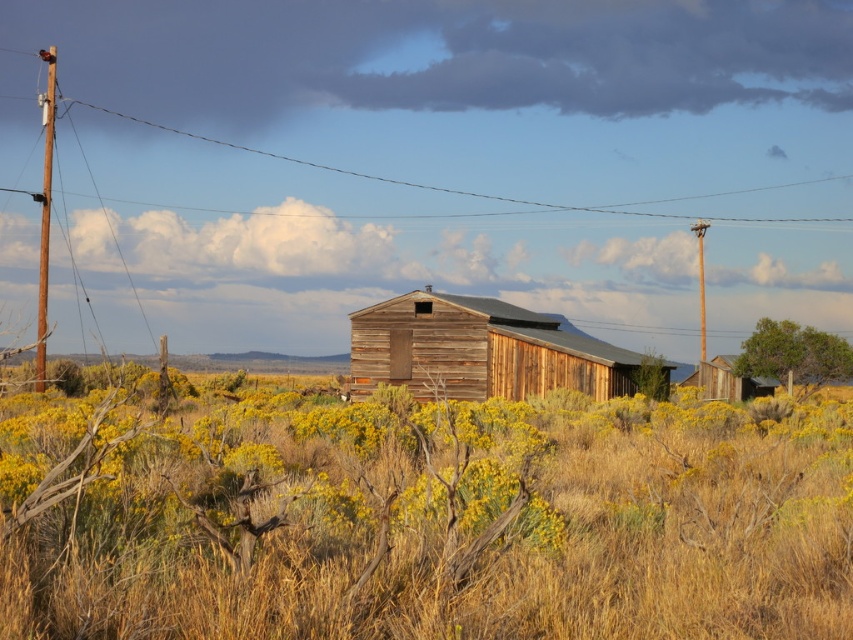
You are standing in the middle of the field and want to reach the weathered wood barn at center. Which direction should you move to get closer to it?

The weathered wood barn at center is located at point coordinates, so you should move towards the center of the field to reach it.

You are standing in front of the rustic wooden building and notice two telegraph poles. The wooden telegraph pole at left and the brown wooden telegraph pole at right. Which one is closer to you?

The wooden telegraph pole at left is closer to you because it is in front of the brown wooden telegraph pole at right.